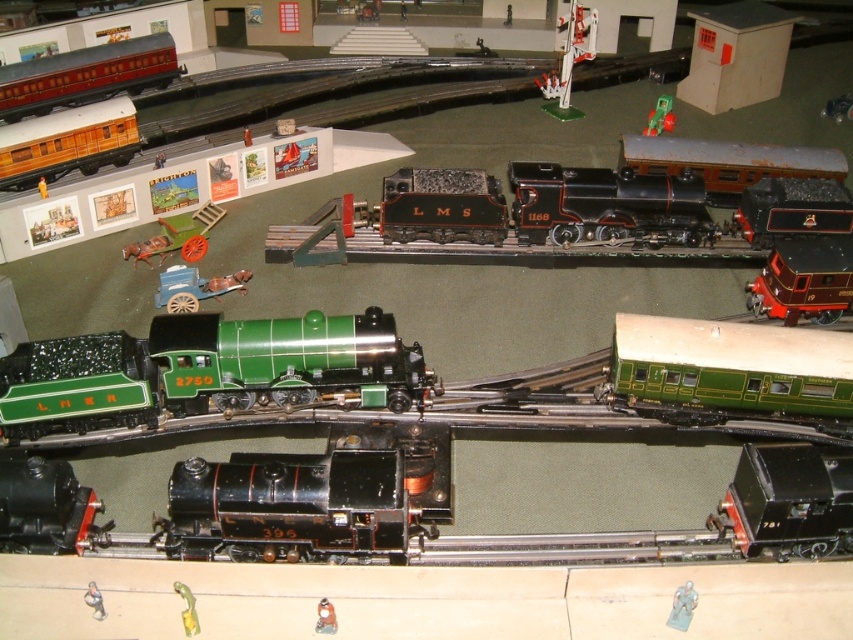
Question: Which point is farther from the camera taking this photo?

Choices:
 (A) (320, 611)
 (B) (317, 403)

Answer: (B)

Question: Observing the image, what is the correct spatial positioning of matte brown train car at right in reference to wooden cart at lower left?

Choices:
 (A) above
 (B) below

Answer: (B)

Question: Which point is farther from the camera taking this photo?

Choices:
 (A) (213, 224)
 (B) (88, 602)

Answer: (A)

Question: Does metallic gold figurine at lower center appear on the right side of shiny black train at center?

Choices:
 (A) no
 (B) yes

Answer: (A)

Question: Can you confirm if metallic silver figure at lower right is bigger than shiny black train at center?

Choices:
 (A) no
 (B) yes

Answer: (A)

Question: Estimate the real-world distances between objects in this image. Which object is closer to the green matte passenger car at center-right?

Choices:
 (A) metallic silver figure at upper center
 (B) metallic silver toy at lower left
 (C) matte red passenger car at upper left
 (D) wooden cart at lower left

Answer: (B)